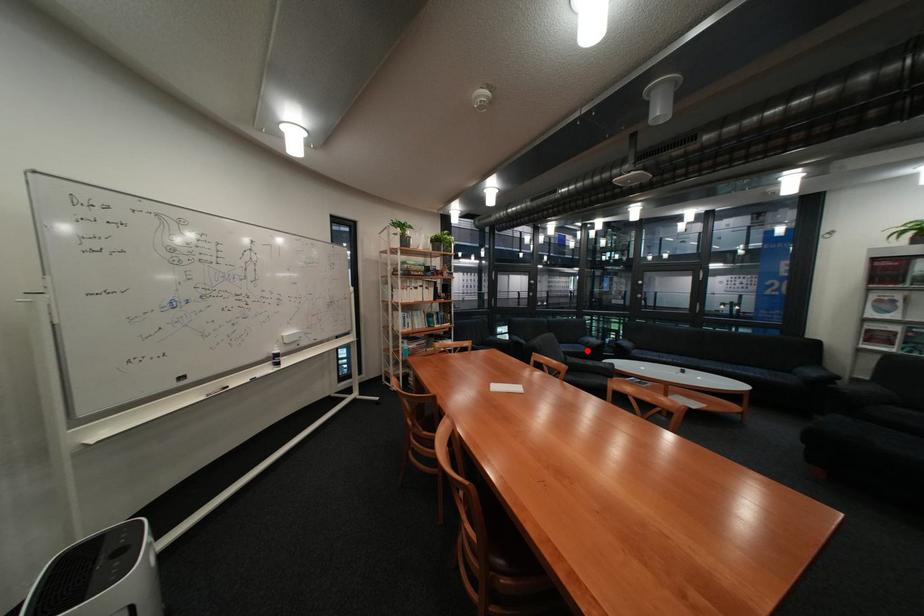
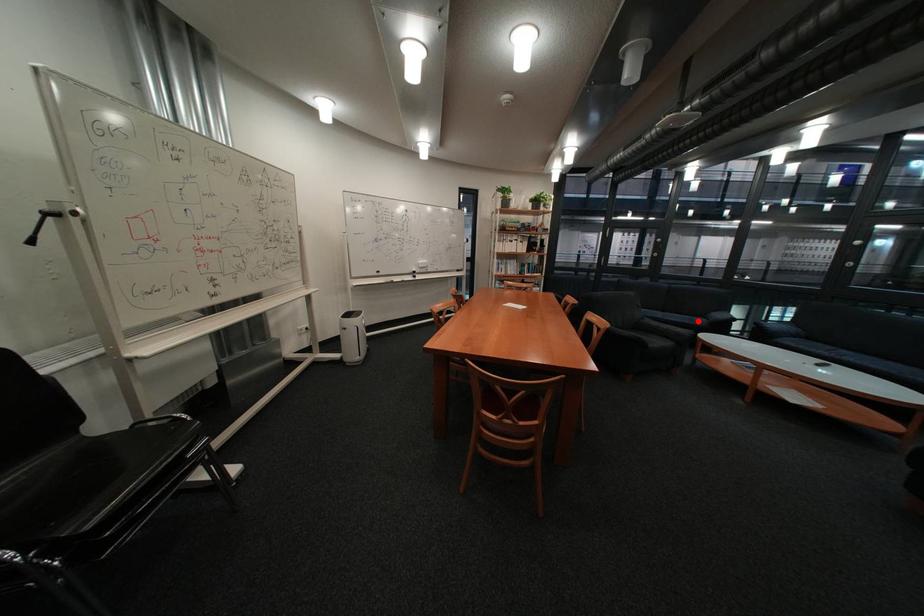
Looking at this image, I am providing you with two images of the same scene from different viewpoints. A red point is marked on the first image and another point is marked on the second image. Is the red point in image1 aligned with the point shown in image2?

Yes